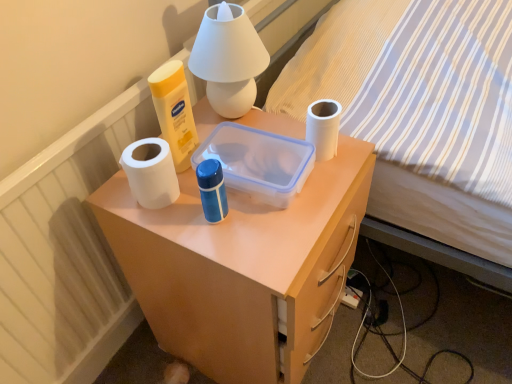
Image resolution: width=512 pixels, height=384 pixels. Identify the location of vacant space in front of white matte paper towel at left. (187, 233).